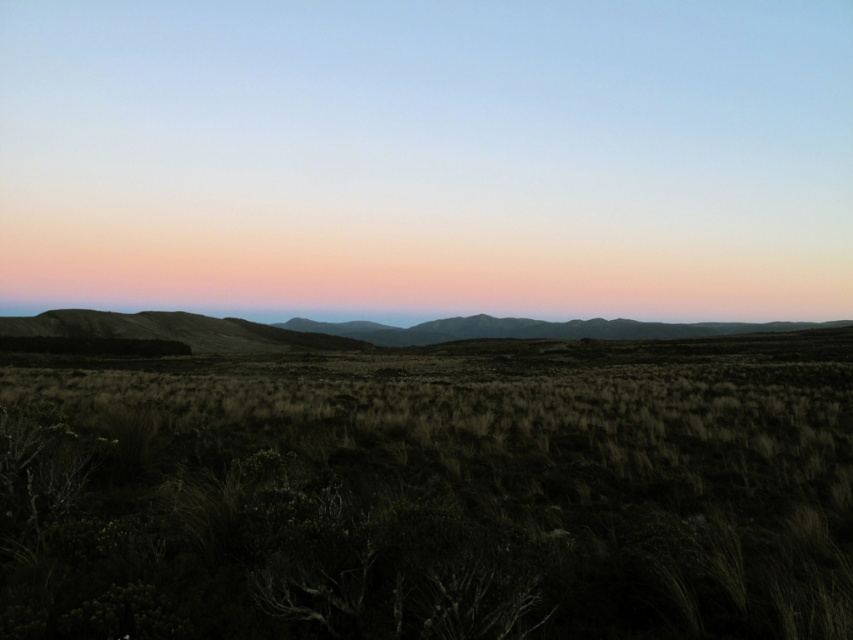
Is smooth grassy plain at center thinner than brown rough grass at center?

No.

Which is behind, point (125, 48) or point (251, 387)?

The point (125, 48) is behind.

Locate an element on the screen. The width and height of the screenshot is (853, 640). smooth grassy plain at center is located at coordinates (428, 157).